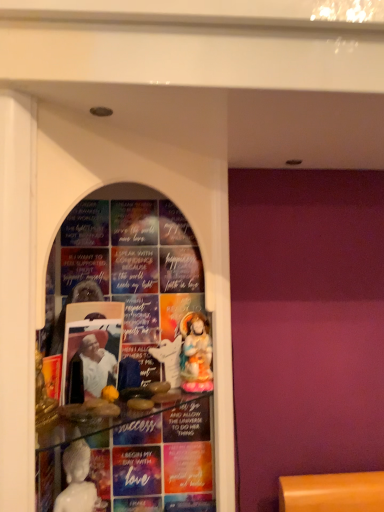
Question: Is white glossy statue at center, which is the second person from back to front, turned away from white glossy statue at center?

Choices:
 (A) no
 (B) yes

Answer: (A)

Question: Could white glossy statue at center be considered to be inside white glossy statue at center, which is the second person from back to front?

Choices:
 (A) no
 (B) yes

Answer: (A)

Question: Does white glossy statue at center, which is the second person from back to front, have a greater width compared to white glossy statue at center?

Choices:
 (A) no
 (B) yes

Answer: (B)

Question: Does white glossy statue at center, the first person viewed from the left, lie behind white glossy statue at center?

Choices:
 (A) no
 (B) yes

Answer: (A)

Question: Is white glossy statue at center, the first person in the front-to-back sequence, outside white glossy statue at center?

Choices:
 (A) yes
 (B) no

Answer: (A)

Question: In terms of size, does white glossy statue at center appear bigger or smaller than transparent glass shelf at center?

Choices:
 (A) small
 (B) big

Answer: (A)

Question: Is point (165, 373) closer or farther from the camera than point (153, 326)?

Choices:
 (A) farther
 (B) closer

Answer: (B)

Question: Which is correct: white glossy statue at center is inside transparent glass shelf at center, or outside of it?

Choices:
 (A) outside
 (B) inside

Answer: (B)

Question: From the image's perspective, is white glossy statue at center located above or below transparent glass shelf at center?

Choices:
 (A) below
 (B) above

Answer: (A)

Question: From their relative heights in the image, would you say white glossy statue at center, which is the second person from back to front, is taller or shorter than porcelain statue at center, the second person viewed from the front?

Choices:
 (A) tall
 (B) short

Answer: (B)

Question: Looking at the image, does white glossy statue at center, the first person viewed from the left, seem bigger or smaller compared to porcelain statue at center, which appears as the 1th person when viewed from the back?

Choices:
 (A) small
 (B) big

Answer: (B)

Question: Does point (87, 347) appear closer or farther from the camera than point (190, 365)?

Choices:
 (A) farther
 (B) closer

Answer: (B)

Question: From a real-world perspective, is white glossy statue at center, the first person in the front-to-back sequence, above or below porcelain statue at center, the second person viewed from the front?

Choices:
 (A) above
 (B) below

Answer: (B)

Question: Would you say white glossy statue at center, the second person in the right-to-left sequence, is to the left or to the right of transparent glass shelf at center in the picture?

Choices:
 (A) right
 (B) left

Answer: (B)

Question: In the image, is white glossy statue at center, which is the second person from back to front, positioned in front of or behind transparent glass shelf at center?

Choices:
 (A) behind
 (B) front

Answer: (A)